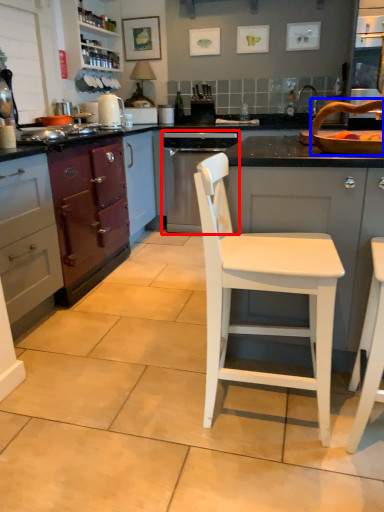
Question: Which point is further to the camera, home appliance (highlighted by a red box) or sink (highlighted by a blue box)?

Choices:
 (A) home appliance
 (B) sink

Answer: (A)